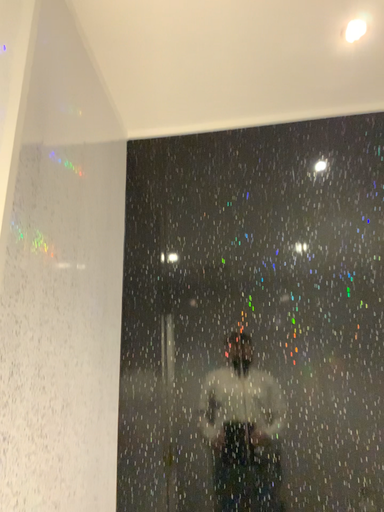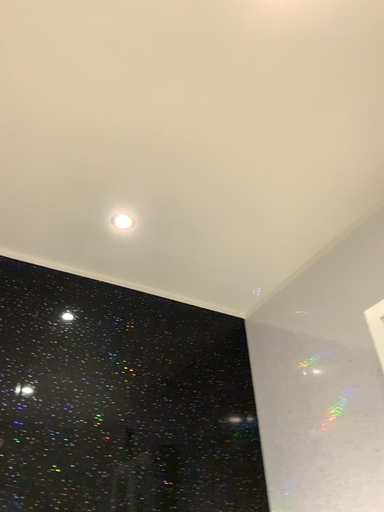
Question: How did the camera likely rotate when shooting the video?

Choices:
 (A) rotated left
 (B) rotated right

Answer: (B)